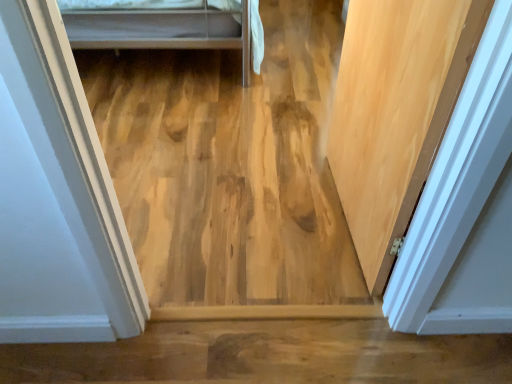
Question: From the image's perspective, is natural wood door at right above or below natural wood plywood at center?

Choices:
 (A) above
 (B) below

Answer: (B)

Question: Relative to natural wood plywood at center, is natural wood door at right in front or behind?

Choices:
 (A) behind
 (B) front

Answer: (B)

Question: In terms of height, does natural wood door at right look taller or shorter compared to natural wood plywood at center?

Choices:
 (A) short
 (B) tall

Answer: (B)

Question: From their relative heights in the image, would you say natural wood plywood at center is taller or shorter than natural wood door at right?

Choices:
 (A) tall
 (B) short

Answer: (B)

Question: From a real-world perspective, is natural wood plywood at center above or below natural wood door at right?

Choices:
 (A) above
 (B) below

Answer: (B)

Question: Considering the relative positions of natural wood plywood at center and natural wood door at right in the image provided, is natural wood plywood at center to the left or to the right of natural wood door at right?

Choices:
 (A) left
 (B) right

Answer: (A)

Question: Based on their sizes in the image, would you say natural wood plywood at center is bigger or smaller than natural wood door at right?

Choices:
 (A) big
 (B) small

Answer: (A)